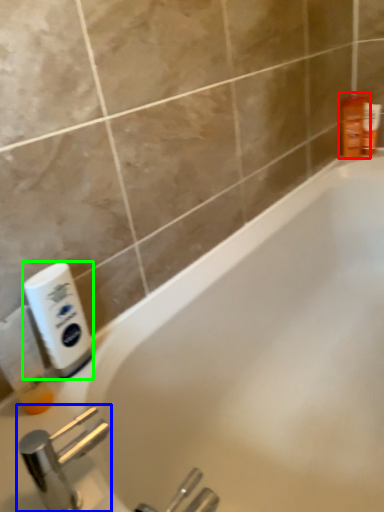
Question: Which object is the closest to the toiletry (highlighted by a red box)? Choose among these: tap (highlighted by a blue box) or cleaning product (highlighted by a green box).

Choices:
 (A) tap
 (B) cleaning product

Answer: (B)